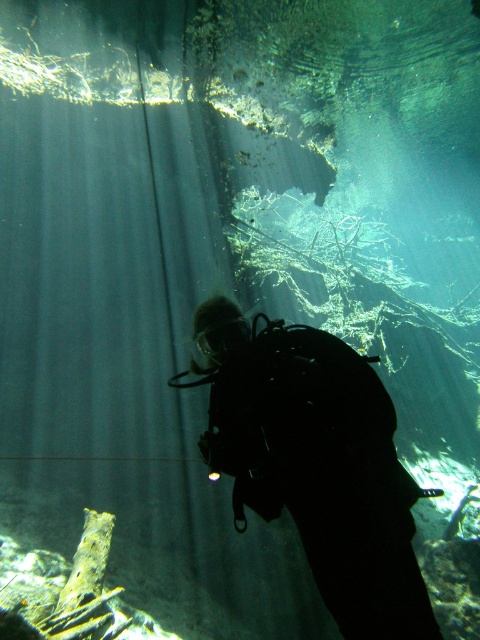
Between black matte scuba diver at center and shiny silver fish at lower right, which one appears on the left side from the viewer's perspective?

Positioned to the left is black matte scuba diver at center.

Does black matte scuba diver at center have a lesser height compared to shiny silver fish at lower right?

No.

What do you see at coordinates (315, 461) in the screenshot?
I see `black matte scuba diver at center` at bounding box center [315, 461].

What are the coordinates of `black matte scuba diver at center` in the screenshot? It's located at (315, 461).